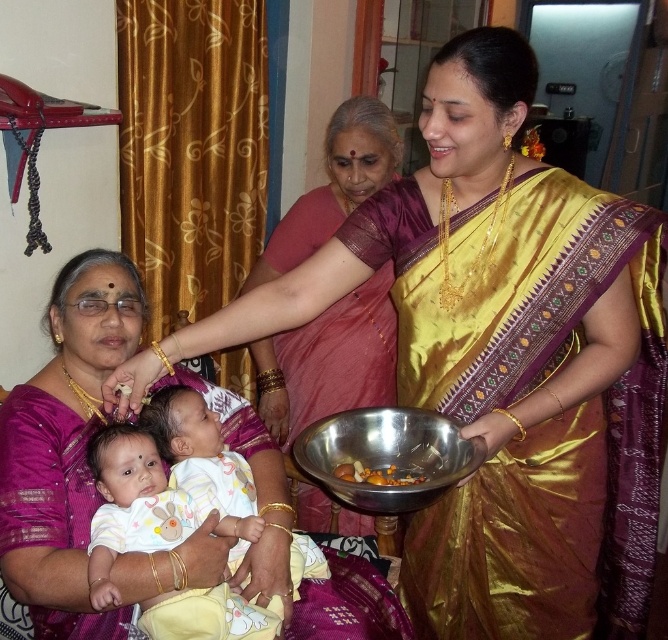
Is white cotton baby at center smaller than shiny metallic bowl at center?

No.

Who is positioned more to the left, white cotton baby at center or shiny metallic bowl at center?

white cotton baby at center is more to the left.

Image resolution: width=668 pixels, height=640 pixels. Identify the location of white cotton baby at center. (130, 504).

Identify the location of white cotton baby at center. (130, 504).

Is white cotton baby at center thinner than metallic bowl at center?

No, white cotton baby at center is not thinner than metallic bowl at center.

Between point (114, 472) and point (361, 448), which one is positioned in front?

Positioned in front is point (114, 472).

Between point (281, 616) and point (405, 488), which one is positioned behind?

Positioned behind is point (281, 616).

Where is `white cotton baby at center`? The height and width of the screenshot is (640, 668). white cotton baby at center is located at coordinates (130, 504).

Where is `silky pink saree at center`? Image resolution: width=668 pixels, height=640 pixels. silky pink saree at center is located at coordinates (329, 360).

Can you confirm if silky pink saree at center is taller than white cotton baby at center?

Yes, silky pink saree at center is taller than white cotton baby at center.

This screenshot has width=668, height=640. Identify the location of silky pink saree at center. pos(329,360).

The width and height of the screenshot is (668, 640). Find the location of `silky pink saree at center`. silky pink saree at center is located at coordinates (329, 360).